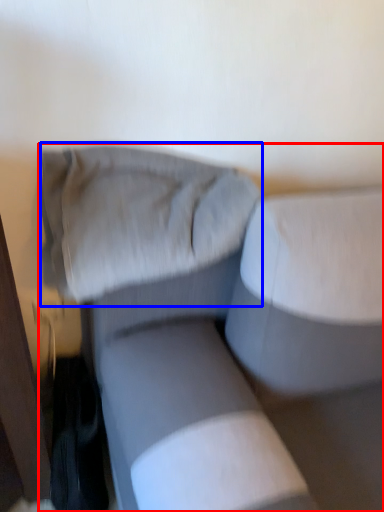
Question: Among these objects, which one is nearest to the camera, studio couch (highlighted by a red box) or pillow (highlighted by a blue box)?

Choices:
 (A) studio couch
 (B) pillow

Answer: (A)